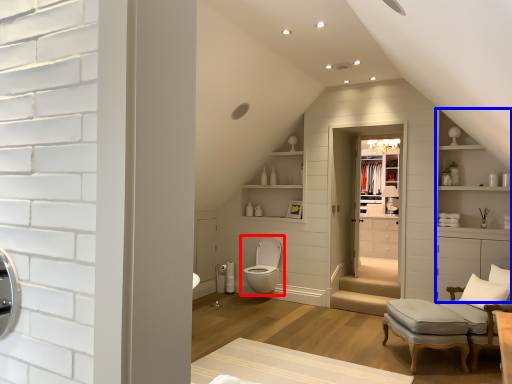
Question: Which object appears farthest to the camera in this image, toilet (highlighted by a red box) or dresser (highlighted by a blue box)?

Choices:
 (A) toilet
 (B) dresser

Answer: (A)